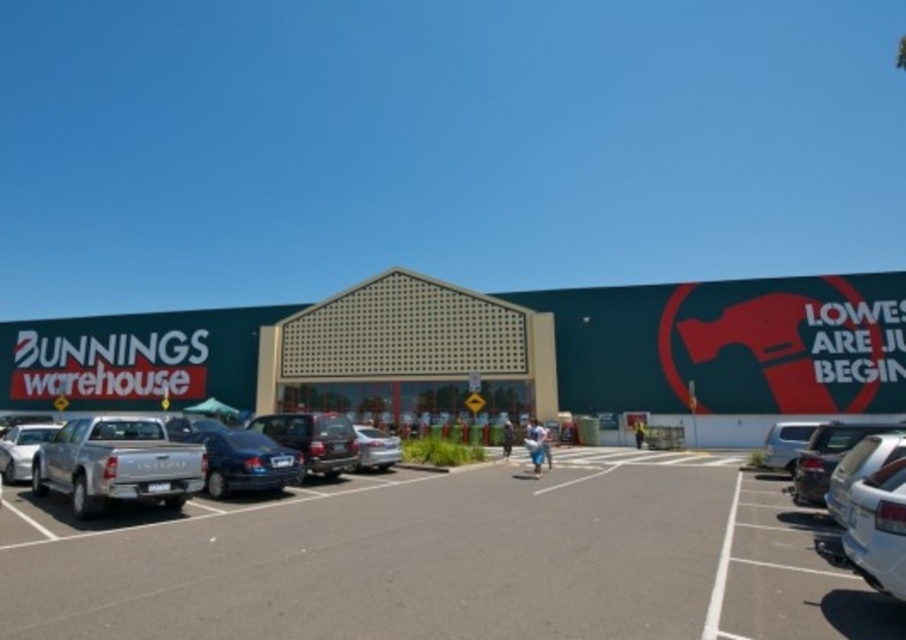
Question: Does metallic gray suv at center appear over satin silver sedan at center?

Choices:
 (A) yes
 (B) no

Answer: (A)

Question: Which object appears closest to the camera in this image?

Choices:
 (A) satin silver sedan at center
 (B) white matte car at lower right
 (C) metallic gray suv at center
 (D) glossy metallic sedan at center

Answer: (B)

Question: Which object is positioned closest to the satin silver sedan at center?

Choices:
 (A) silver metallic truck at left
 (B) glossy metallic sedan at center
 (C) silver metallic pickup truck at left

Answer: (C)

Question: Can you confirm if white matte car at lower right is thinner than glossy metallic sedan at center?

Choices:
 (A) no
 (B) yes

Answer: (A)

Question: Which point is closer to the camera?

Choices:
 (A) metallic silver car at right
 (B) silver metallic pickup truck at left
 (C) silver metallic truck at left

Answer: (B)

Question: Does metallic gray suv at center have a greater width compared to silver metallic truck at left?

Choices:
 (A) yes
 (B) no

Answer: (B)